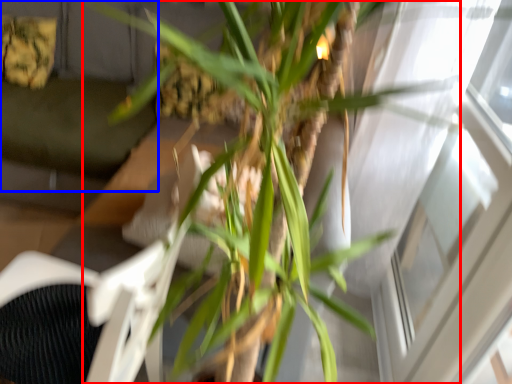
Question: Which object is closer to the camera taking this photo, houseplant (highlighted by a red box) or couch (highlighted by a blue box)?

Choices:
 (A) houseplant
 (B) couch

Answer: (A)